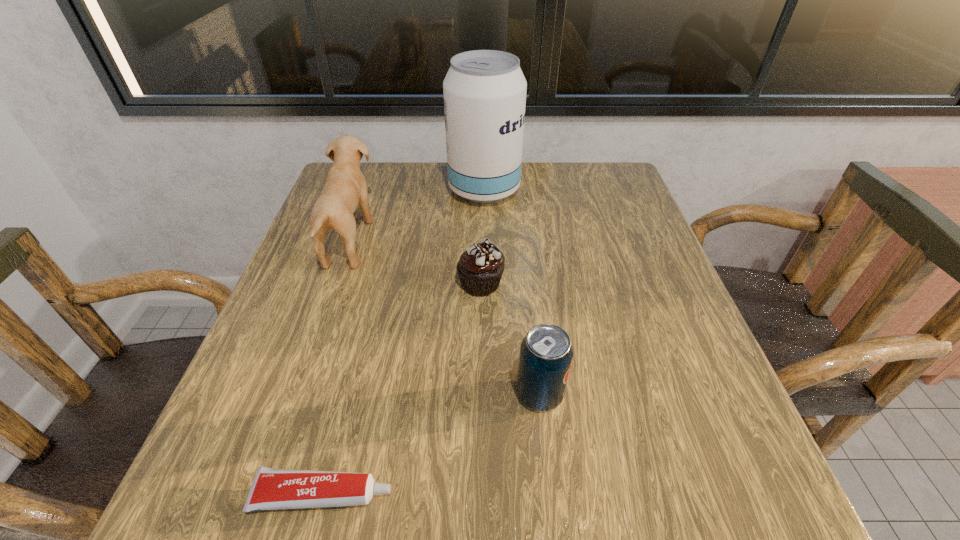
In the image, there is a desktop. Where is `blank space at the near edge`? blank space at the near edge is located at coordinates (636, 490).

Locate an element on the screen. This screenshot has width=960, height=540. vacant space at the left edge of the desktop is located at coordinates (290, 286).

Where is `vacant area at the right edge of the desktop`? vacant area at the right edge of the desktop is located at coordinates (664, 312).

Locate an element on the screen. free space at the far left corner is located at coordinates (377, 188).

The image size is (960, 540). I want to click on empty space between the fourth shortest object and the third shortest object, so click(x=444, y=318).

You are a GUI agent. You are given a task and a screenshot of the screen. Output one action in this format:
    pyautogui.click(x=<x>, y=<y>)
    Task: Click on the vacant space in between the second tallest object and the tallest object
    This screenshot has width=960, height=540.
    Given the screenshot: What is the action you would take?
    pyautogui.click(x=417, y=215)

In order to click on free space that is in between the tallest object and the second nearest object in this screenshot , I will do `click(512, 292)`.

Locate an element on the screen. The height and width of the screenshot is (540, 960). vacant space in between the fourth tallest object and the soda can is located at coordinates (510, 339).

Locate an element on the screen. free point between the second tallest object and the second shortest object is located at coordinates (415, 262).

Identify the location of free spot between the fourth tallest object and the tallest object. (482, 237).